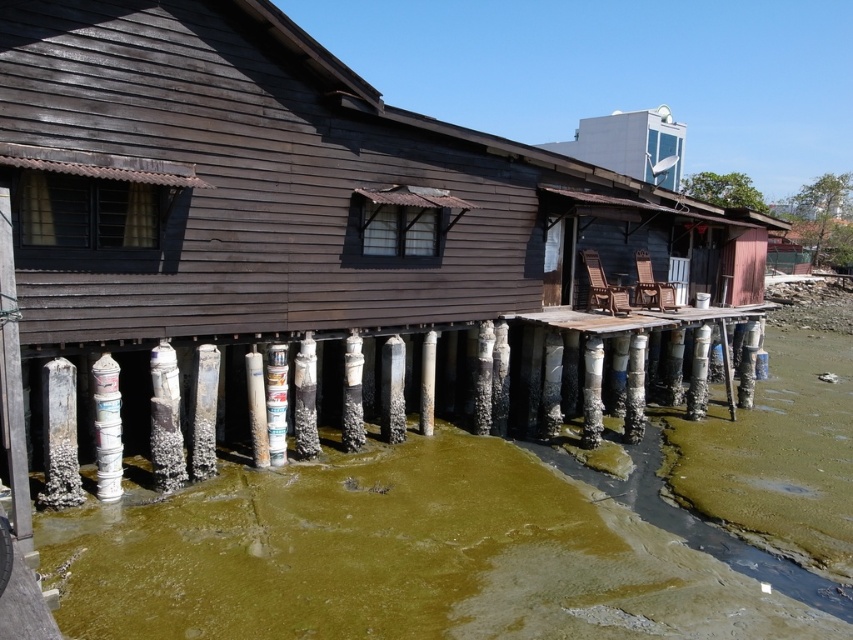
You are an architect assessing the structural integrity of the elevated wooden structure. You notice the white painted wood pillar at lower left and the rusty metal pillar at center. Which pillar has a greater width?

The white painted wood pillar at lower left has a greater width than the rusty metal pillar at center according to the description.

You are a contractor assessing the stability of the structure. You notice two white supports, the white painted wood pillar at lower left and the white weathered wood post at center. Which support is taller?

The white painted wood pillar at lower left has a greater height compared to the white weathered wood post at center, so the white painted wood pillar at lower left is taller.

You are standing on the wooden structure and looking towards the water. Which object is positioned to the right of the other between the white glossy satellite dish at upper center and the dirty white wood pillar at lower center?

The white glossy satellite dish at upper center is to the right of the dirty white wood pillar at lower center.